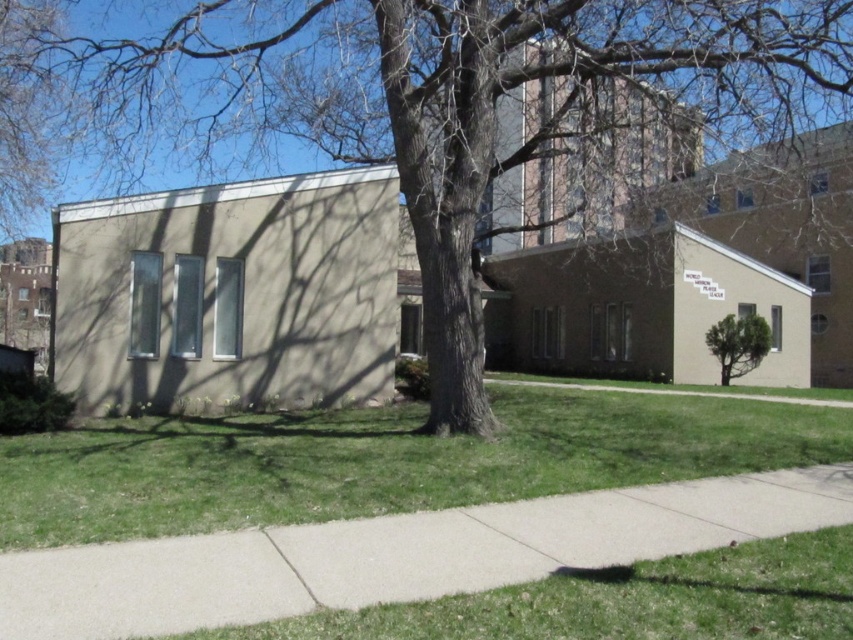
You are standing at the center of the image. Which direction should you walk to reach the green grass at lower left?

You should walk towards the lower left direction to reach the green grass at lower left.

You are standing at the point marked by point [396,554] on the image. What object are you currently standing on?

You are standing on the concrete sidewalk at center, as the point [396,554] represents the concrete sidewalk at center.